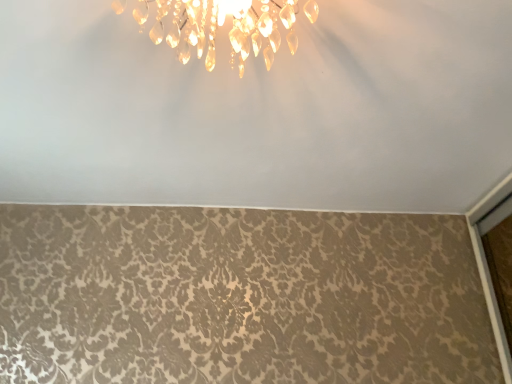
Describe the element at coordinates (259, 110) in the screenshot. The height and width of the screenshot is (384, 512). I see `damask wallpaper at center` at that location.

Measure the distance between damask wallpaper at center and camera.

The depth of damask wallpaper at center is 37.34 inches.

Locate an element on the screen. The width and height of the screenshot is (512, 384). damask wallpaper at center is located at coordinates (259, 110).

Locate an element on the screen. The height and width of the screenshot is (384, 512). damask wallpaper at center is located at coordinates (259, 110).